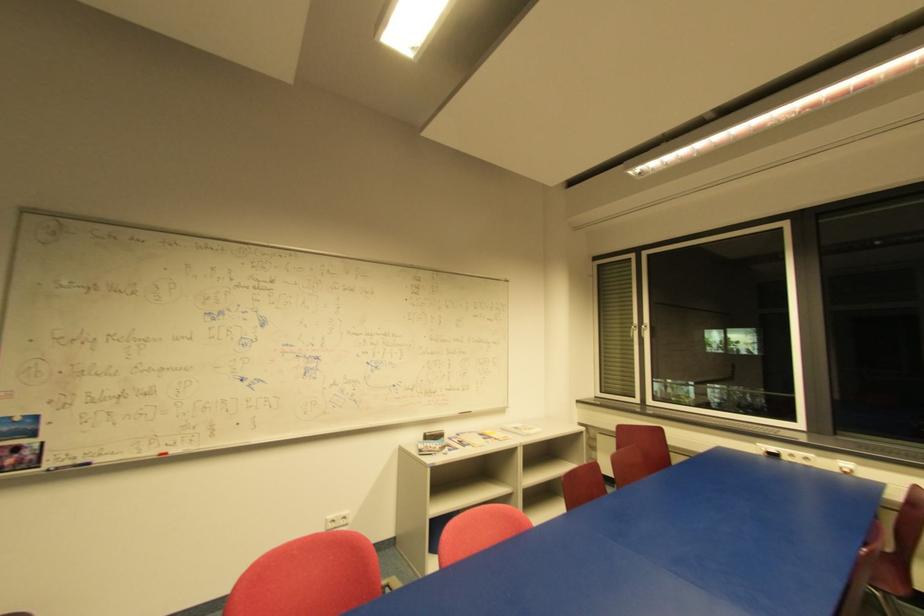
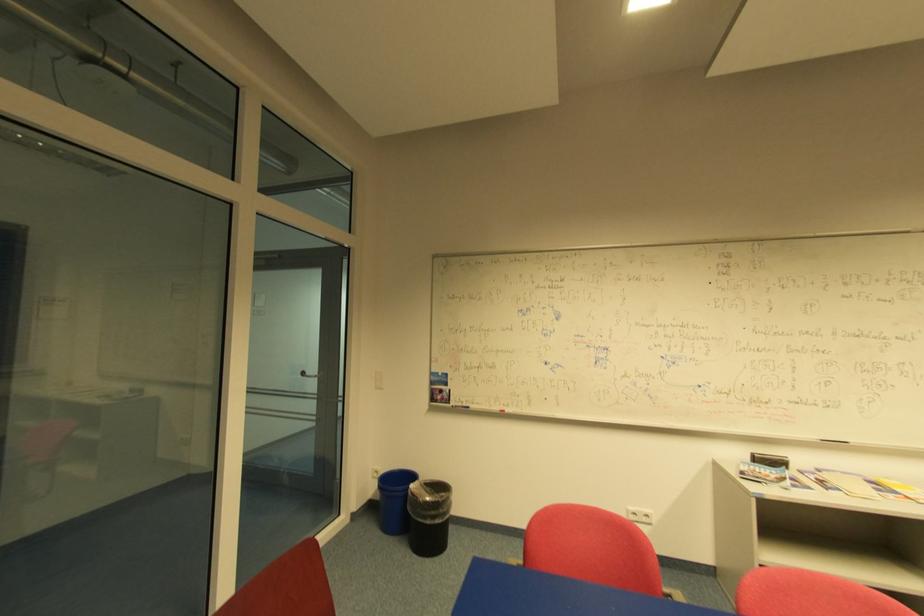
Question: Based on the continuous images, in which direction is the camera rotating? Reply with the corresponding letter.

Choices:
 (A) Left
 (B) Right
 (C) Up
 (D) Down

Answer: (A)